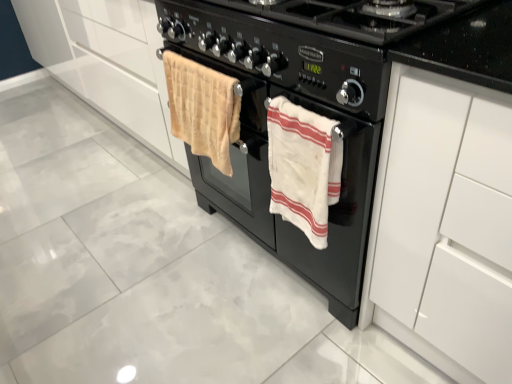
Question: Does black matte gas stove at center have a larger size compared to beige plush towel at center, acting as the 1th beach towel starting from the left?

Choices:
 (A) no
 (B) yes

Answer: (B)

Question: Considering the relative sizes of black matte gas stove at center and beige plush towel at center, acting as the 1th beach towel starting from the left, in the image provided, is black matte gas stove at center wider than beige plush towel at center, acting as the 1th beach towel starting from the left,?

Choices:
 (A) yes
 (B) no

Answer: (A)

Question: Considering the relative positions of black matte gas stove at center and beige plush towel at center, the 2th beach towel viewed from the right, in the image provided, is black matte gas stove at center to the right of beige plush towel at center, the 2th beach towel viewed from the right, from the viewer's perspective?

Choices:
 (A) no
 (B) yes

Answer: (B)

Question: Is the surface of black matte gas stove at center in direct contact with beige plush towel at center, the 2th beach towel viewed from the right?

Choices:
 (A) no
 (B) yes

Answer: (A)

Question: Would you say black matte gas stove at center contains beige plush towel at center, acting as the 1th beach towel starting from the left?

Choices:
 (A) no
 (B) yes

Answer: (A)

Question: Are black matte gas stove at center and beige plush towel at center, acting as the 1th beach towel starting from the left, located far from each other?

Choices:
 (A) no
 (B) yes

Answer: (A)

Question: Is beige plush towel at center, the 2th beach towel viewed from the right, smaller than black matte oven at center?

Choices:
 (A) no
 (B) yes

Answer: (B)

Question: From a real-world perspective, is beige plush towel at center, acting as the 1th beach towel starting from the left, beneath black matte oven at center?

Choices:
 (A) yes
 (B) no

Answer: (B)

Question: Does beige plush towel at center, the 2th beach towel viewed from the right, have a lesser width compared to black matte oven at center?

Choices:
 (A) yes
 (B) no

Answer: (A)

Question: Considering the relative positions of beige plush towel at center, the 2th beach towel viewed from the right, and black matte oven at center in the image provided, is beige plush towel at center, the 2th beach towel viewed from the right, in front of black matte oven at center?

Choices:
 (A) yes
 (B) no

Answer: (B)

Question: From the image's perspective, is beige plush towel at center, the 2th beach towel viewed from the right, located above black matte oven at center?

Choices:
 (A) no
 (B) yes

Answer: (B)

Question: Is beige plush towel at center, the 2th beach towel viewed from the right, directly adjacent to black matte oven at center?

Choices:
 (A) no
 (B) yes

Answer: (A)

Question: From the image's perspective, is white cotton towel at center, acting as the 1th beach towel starting from the right, below black matte gas stove at center?

Choices:
 (A) yes
 (B) no

Answer: (A)